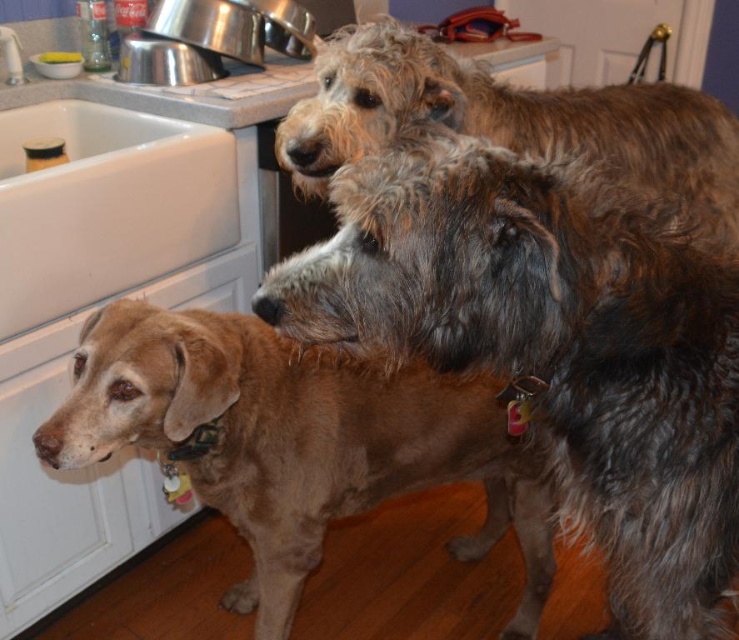
Question: Is white ceramic sink at left closer to camera compared to matte plastic bowl at sink left?

Choices:
 (A) yes
 (B) no

Answer: (A)

Question: Which object is farther from the camera taking this photo?

Choices:
 (A) fuzzy brown dog at center
 (B) brown fur dog at left

Answer: (B)

Question: Does fuzzy brown dog at center have a greater width compared to brown fur dog at left?

Choices:
 (A) no
 (B) yes

Answer: (A)

Question: Considering the real-world distances, which object is farthest from the fuzzy brown dog at upper center?

Choices:
 (A) fuzzy brown dog at center
 (B) matte plastic bowl at sink left

Answer: (B)

Question: Is fuzzy brown dog at upper center to the left of matte plastic bowl at sink left from the viewer's perspective?

Choices:
 (A) yes
 (B) no

Answer: (B)

Question: Which object is farther from the camera taking this photo?

Choices:
 (A) fuzzy brown dog at upper center
 (B) matte plastic bowl at sink left

Answer: (B)